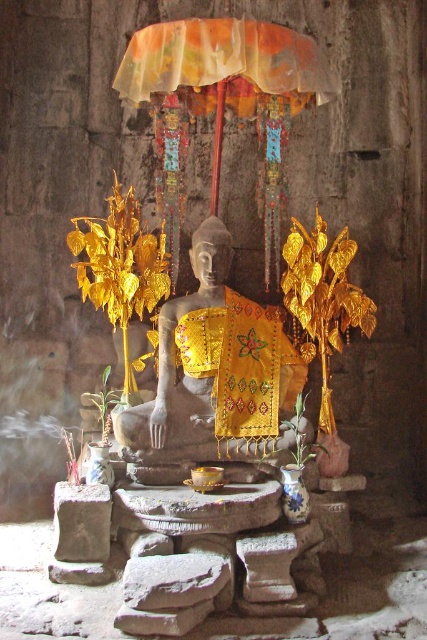
Question: Can you confirm if yellow embroidered cloth at center is thinner than translucent fabric umbrella at upper center?

Choices:
 (A) no
 (B) yes

Answer: (B)

Question: Which point is closer to the camera taking this photo?

Choices:
 (A) (125, 72)
 (B) (139, 452)

Answer: (A)

Question: Can you confirm if yellow embroidered cloth at center is positioned to the left of translucent fabric umbrella at upper center?

Choices:
 (A) no
 (B) yes

Answer: (B)

Question: In this image, where is yellow embroidered cloth at center located relative to translucent fabric umbrella at upper center?

Choices:
 (A) left
 (B) right

Answer: (A)

Question: Which object is farther from the camera taking this photo?

Choices:
 (A) translucent fabric umbrella at upper center
 (B) yellow embroidered cloth at center

Answer: (B)

Question: Which object appears farthest from the camera in this image?

Choices:
 (A) translucent fabric umbrella at upper center
 (B) yellow embroidered cloth at center

Answer: (B)